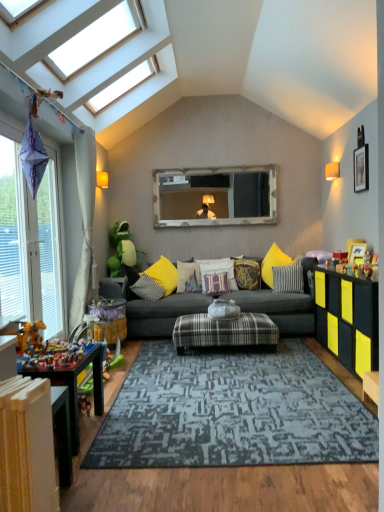
Question: From the image's perspective, is yellow matte cabinet at right located above green plush toy at center, placed as the 2th toy when sorted from bottom to top?

Choices:
 (A) no
 (B) yes

Answer: (A)

Question: Considering the relative sizes of yellow matte cabinet at right and green plush toy at center, placed as the 2th toy when sorted from bottom to top, in the image provided, is yellow matte cabinet at right wider than green plush toy at center, placed as the 2th toy when sorted from bottom to top,?

Choices:
 (A) yes
 (B) no

Answer: (B)

Question: Can you confirm if yellow matte cabinet at right is bigger than green plush toy at center, the 1th toy when ordered from top to bottom?

Choices:
 (A) no
 (B) yes

Answer: (B)

Question: Is yellow matte cabinet at right thinner than green plush toy at center, placed as the 2th toy when sorted from bottom to top?

Choices:
 (A) yes
 (B) no

Answer: (A)

Question: Does yellow matte cabinet at right have a smaller size compared to green plush toy at center, the first toy from the back?

Choices:
 (A) yes
 (B) no

Answer: (B)

Question: From a real-world perspective, is yellow matte cabinet at right below green plush toy at center, which ranks as the second toy in front-to-back order?

Choices:
 (A) yes
 (B) no

Answer: (A)

Question: Is white cotton pillow at center, the 4th pillow when ordered from left to right, taller than multicolored plastic toys at lower left, which is the first toy from bottom to top?

Choices:
 (A) yes
 (B) no

Answer: (A)

Question: Is white cotton pillow at center, the 4th pillow when ordered from left to right, positioned with its back to multicolored plastic toys at lower left, marked as the first toy in a front-to-back arrangement?

Choices:
 (A) yes
 (B) no

Answer: (B)

Question: Can you confirm if white cotton pillow at center, the 4th pillow when ordered from left to right, is wider than multicolored plastic toys at lower left, which is the first toy from bottom to top?

Choices:
 (A) no
 (B) yes

Answer: (A)

Question: Does white cotton pillow at center, the 4th pillow when ordered from left to right, have a smaller size compared to multicolored plastic toys at lower left, which is the first toy from bottom to top?

Choices:
 (A) yes
 (B) no

Answer: (B)

Question: Can you confirm if white cotton pillow at center, the 3th pillow in the right-to-left sequence, is positioned to the left of multicolored plastic toys at lower left, the 2th toy from the top?

Choices:
 (A) yes
 (B) no

Answer: (B)

Question: Is white cotton pillow at center, the 3th pillow in the right-to-left sequence, to the right of multicolored plastic toys at lower left, the 2th toy from the top, from the viewer's perspective?

Choices:
 (A) no
 (B) yes

Answer: (B)

Question: Is beige fabric curtain at left outside of wooden picture frame at right, which is the 2th picture frame from right to left?

Choices:
 (A) yes
 (B) no

Answer: (A)